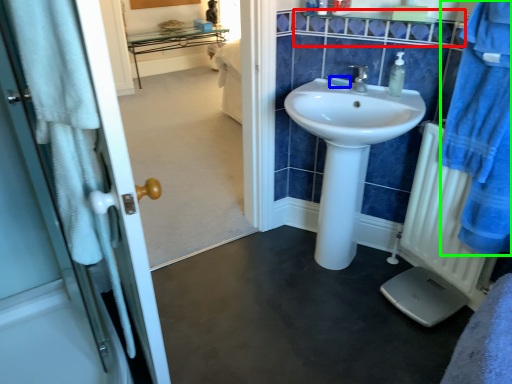
Question: Which is nearer to the balustrade (highlighted by a red box)? soap (highlighted by a blue box) or bathrobe (highlighted by a green box).

Choices:
 (A) soap
 (B) bathrobe

Answer: (A)